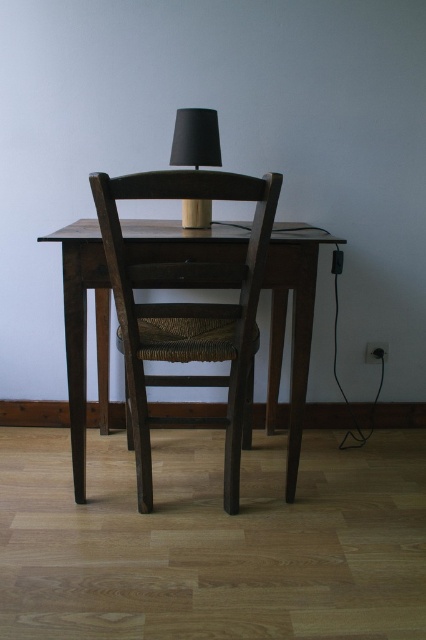
You are trying to determine if the dark wood chair at center can fit through a doorway that is the same width as the black matte table lamp at center. Based on their widths, can the chair pass through the doorway?

The dark wood chair at center might be wider than the black matte table lamp at center, so it is uncertain if the chair can pass through the doorway. The width of the doorway matches the lamp, so if the chair is indeed wider, it would not fit.

You are a person who is 1.7 meters tall. You want to sit in the dark wood chair at center. Considering your height, will your knees hit the desk when sitting?

The dark wood chair at center is 1.39 meters away from the camera, but this distance does not provide information about the chair height or desk clearance. Therefore, it is impossible to determine if your knees will hit the desk when sitting.

You are sitting on the dark wood chair at center and want to turn on the black matte table lamp at center. Can you reach the lamp without moving from your seat?

The dark wood chair at center is in front of the black matte table lamp at center, so you are facing away from the lamp. You would need to turn around or move to reach it.